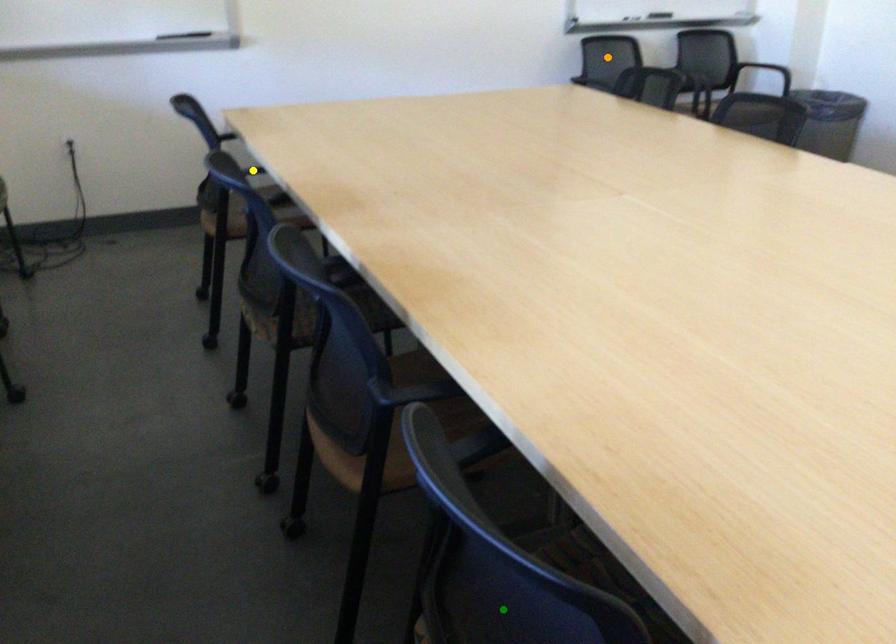
Order these from nearest to farthest:
- green point
- orange point
- yellow point

green point → yellow point → orange point